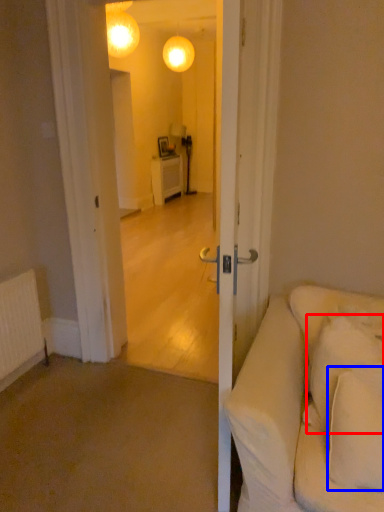
Question: Which point is closer to the camera, pillow (highlighted by a red box) or pillow (highlighted by a blue box)?

Choices:
 (A) pillow
 (B) pillow

Answer: (B)